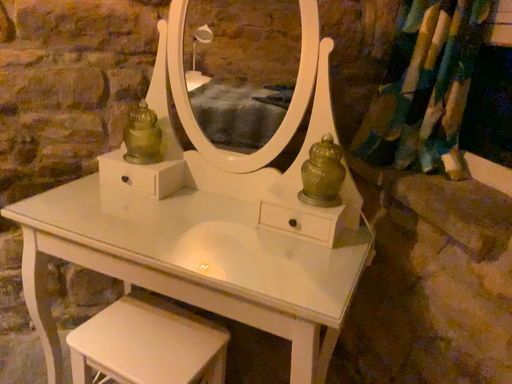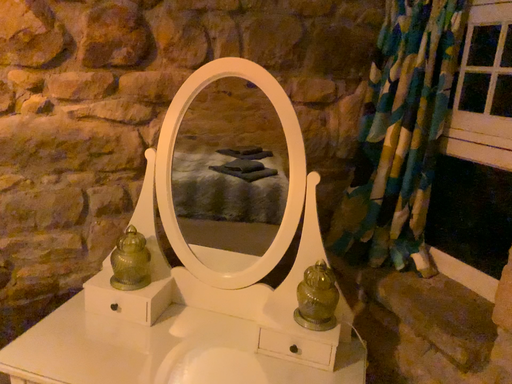
Question: How did the camera likely rotate when shooting the video?

Choices:
 (A) rotated right
 (B) rotated left

Answer: (A)